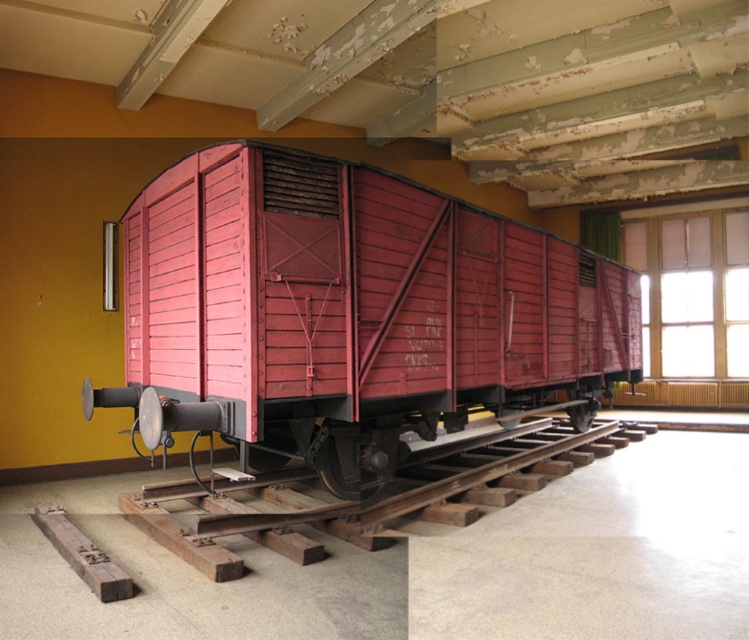
Is matte wood train car at center further to camera compared to wooden at center?

No, it is not.

Consider the image. Who is shorter, matte wood train car at center or wooden at center?

wooden at center

Which is behind, point (443, 339) or point (452, 444)?

The point (452, 444) is more distant.

Where is `matte wood train car at center`? The image size is (749, 640). matte wood train car at center is located at coordinates pyautogui.click(x=351, y=310).